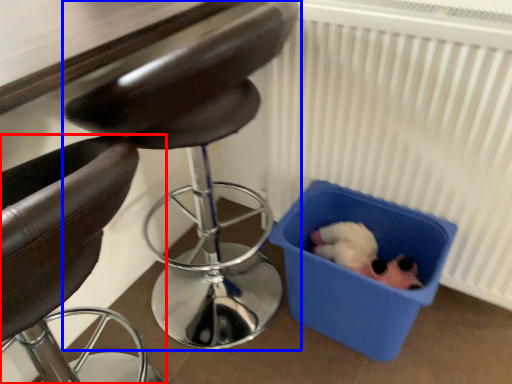
Question: Which of the following is the closest to the observer, chair (highlighted by a red box) or chair (highlighted by a blue box)?

Choices:
 (A) chair
 (B) chair

Answer: (A)